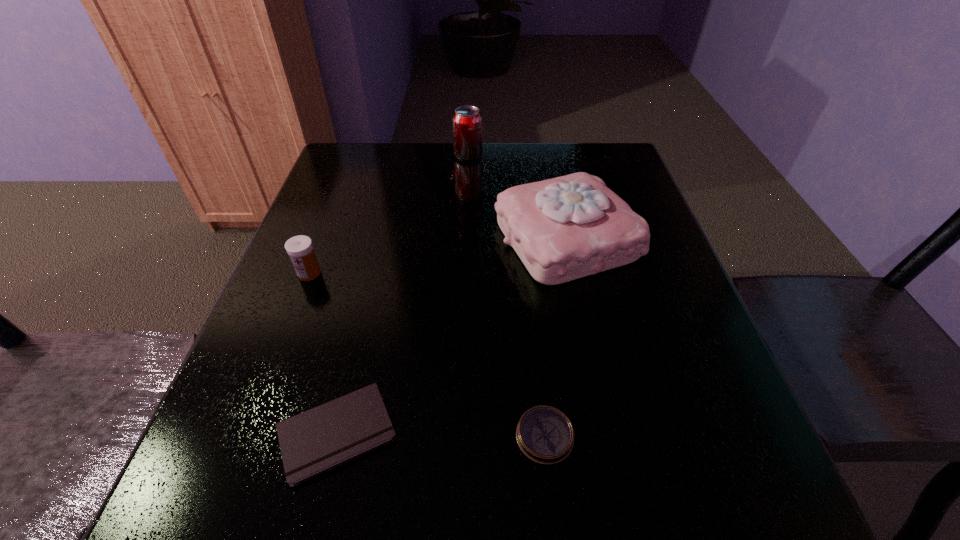
At what (x,y) coordinates should I click in order to perform the action: click on blank space located 0.170m on the left of the compass. Please return your answer as a coordinate pair (x, y). The image size is (960, 540). Looking at the image, I should click on (402, 436).

Identify the location of vacant space located on the right of the second object from left to right. This screenshot has height=540, width=960. pos(470,433).

Locate an element on the screen. The height and width of the screenshot is (540, 960). object located in the far edge section of the desktop is located at coordinates (467, 120).

Find the location of a particular element. The width and height of the screenshot is (960, 540). compass that is positioned at the near edge is located at coordinates (545, 435).

What are the coordinates of `checkbook located at the near edge` in the screenshot? It's located at (318, 440).

Where is `medicine located at the left edge`? The height and width of the screenshot is (540, 960). medicine located at the left edge is located at coordinates (300, 249).

Find the location of a particular element. Image resolution: width=960 pixels, height=540 pixels. checkbook present at the left edge is located at coordinates (318, 440).

You are a GUI agent. You are given a task and a screenshot of the screen. Output one action in this format:
    pyautogui.click(x=<x>, y=<y>)
    Task: Click on the object located at the right edge
    The height and width of the screenshot is (540, 960).
    Given the screenshot: What is the action you would take?
    pyautogui.click(x=565, y=228)

I want to click on object that is at the near left corner, so click(318, 440).

Where is `vacant space at the far edge of the desktop`? The image size is (960, 540). vacant space at the far edge of the desktop is located at coordinates (454, 156).